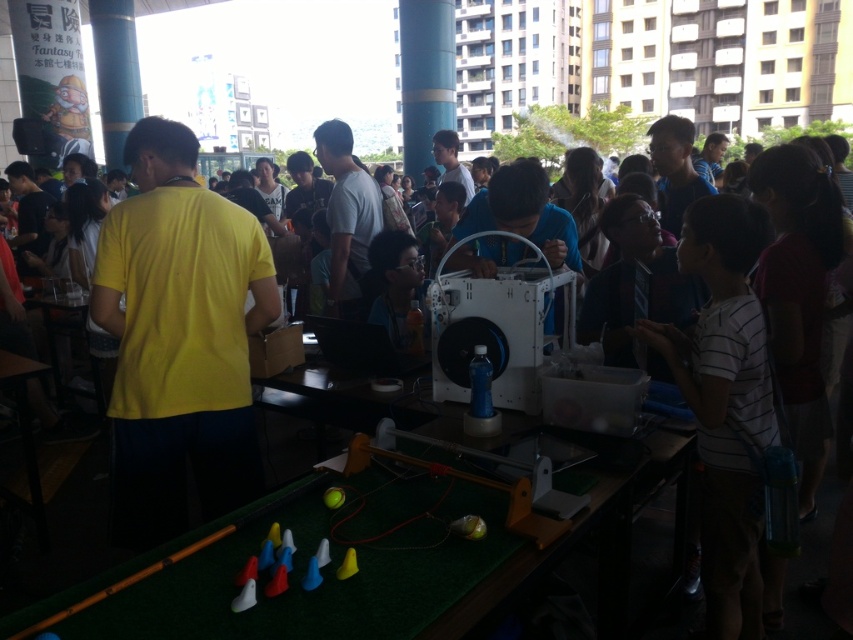
Is yellow matte shirt at center to the right of white striped shirt at center from the viewer's perspective?

Incorrect, yellow matte shirt at center is not on the right side of white striped shirt at center.

Between point (277, 304) and point (730, 248), which one is positioned in front?

Point (730, 248) is in front.

Locate an element on the screen. This screenshot has height=640, width=853. yellow matte shirt at center is located at coordinates (178, 339).